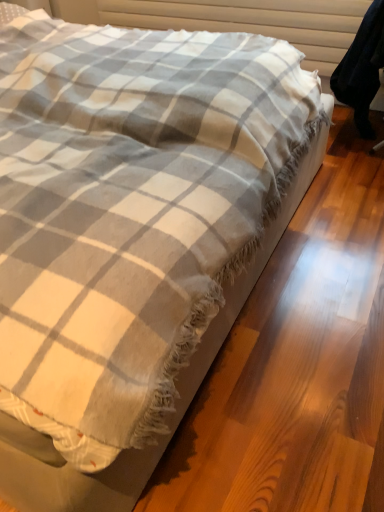
Find the location of a particular element. The image size is (384, 512). vacant area that is in front of dark blue fabric swivel chair at right is located at coordinates (357, 166).